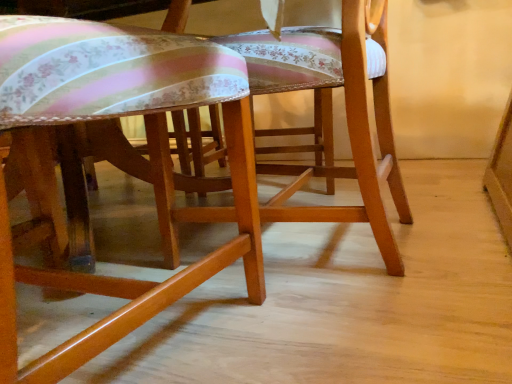
Question: Is matte wood chair at center, the 1th chair in the left-to-right sequence, wider than wooden chair at center, placed as the 1th chair when sorted from right to left?

Choices:
 (A) no
 (B) yes

Answer: (B)

Question: From the image's perspective, does matte wood chair at center, acting as the second chair starting from the right, appear lower than wooden chair at center, the 2th chair when ordered from left to right?

Choices:
 (A) yes
 (B) no

Answer: (A)

Question: Is matte wood chair at center, acting as the second chair starting from the right, taller than wooden chair at center, placed as the 1th chair when sorted from right to left?

Choices:
 (A) yes
 (B) no

Answer: (B)

Question: Is matte wood chair at center, the 1th chair in the left-to-right sequence, outside wooden chair at center, the 2th chair when ordered from left to right?

Choices:
 (A) yes
 (B) no

Answer: (A)

Question: Is wooden chair at center, placed as the 1th chair when sorted from right to left, located within matte wood chair at center, the 1th chair in the left-to-right sequence?

Choices:
 (A) no
 (B) yes

Answer: (A)

Question: Considering the relative sizes of matte wood chair at center, acting as the second chair starting from the right, and wooden chair at center, the 2th chair when ordered from left to right, in the image provided, is matte wood chair at center, acting as the second chair starting from the right, shorter than wooden chair at center, the 2th chair when ordered from left to right,?

Choices:
 (A) no
 (B) yes

Answer: (B)

Question: From a real-world perspective, is wooden chair at center, placed as the 1th chair when sorted from right to left, positioned under matte wood chair at center, acting as the second chair starting from the right, based on gravity?

Choices:
 (A) no
 (B) yes

Answer: (B)

Question: From the image's perspective, is wooden chair at center, placed as the 1th chair when sorted from right to left, located above matte wood chair at center, the 1th chair in the left-to-right sequence?

Choices:
 (A) yes
 (B) no

Answer: (A)

Question: Is wooden chair at center, placed as the 1th chair when sorted from right to left, taller than matte wood chair at center, acting as the second chair starting from the right?

Choices:
 (A) no
 (B) yes

Answer: (B)

Question: Is wooden chair at center, placed as the 1th chair when sorted from right to left, shorter than matte wood chair at center, the 1th chair in the left-to-right sequence?

Choices:
 (A) yes
 (B) no

Answer: (B)

Question: Considering the relative positions of wooden chair at center, the 2th chair when ordered from left to right, and matte wood chair at center, acting as the second chair starting from the right, in the image provided, is wooden chair at center, the 2th chair when ordered from left to right, behind matte wood chair at center, acting as the second chair starting from the right,?

Choices:
 (A) no
 (B) yes

Answer: (B)

Question: Would you consider wooden chair at center, placed as the 1th chair when sorted from right to left, to be distant from matte wood chair at center, the 1th chair in the left-to-right sequence?

Choices:
 (A) no
 (B) yes

Answer: (A)

Question: Is matte wood chair at center, the 1th chair in the left-to-right sequence, wider or thinner than wooden chair at center, the 2th chair when ordered from left to right?

Choices:
 (A) thin
 (B) wide

Answer: (B)